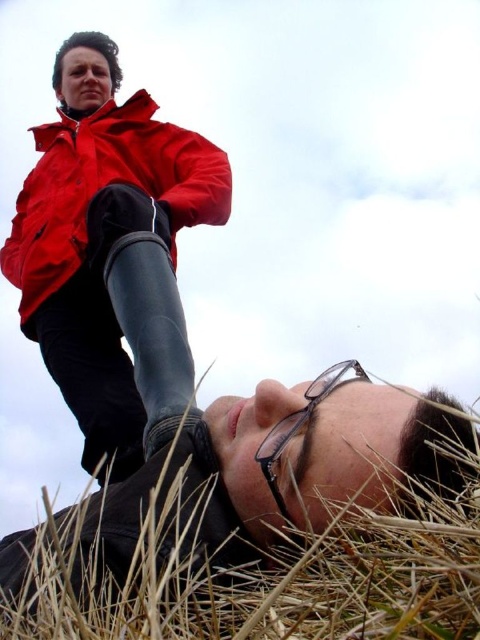
Where is `brown dry grass at lower center`? brown dry grass at lower center is located at coordinates (192, 497).

Which is below, brown dry grass at lower center or matte red jacket at upper left?

brown dry grass at lower center is lower down.

Describe the element at coordinates (192, 497) in the screenshot. I see `brown dry grass at lower center` at that location.

Where is `brown dry grass at lower center`? This screenshot has height=640, width=480. brown dry grass at lower center is located at coordinates (192, 497).

Who is more forward, (325, 515) or (272, 433)?

Point (325, 515)

Is point (265, 426) closer to viewer compared to point (324, 381)?

That is True.

This screenshot has height=640, width=480. What are the coordinates of `brown dry grass at lower center` in the screenshot? It's located at (192, 497).

Which is behind, point (142, 138) or point (285, 420)?

Positioned behind is point (142, 138).

Who is shorter, matte red jacket at upper left or transparent plastic glasses at lower center?

transparent plastic glasses at lower center is shorter.

Between point (64, 268) and point (336, 364), which one is positioned in front?

Positioned in front is point (336, 364).

I want to click on matte red jacket at upper left, so click(x=104, y=186).